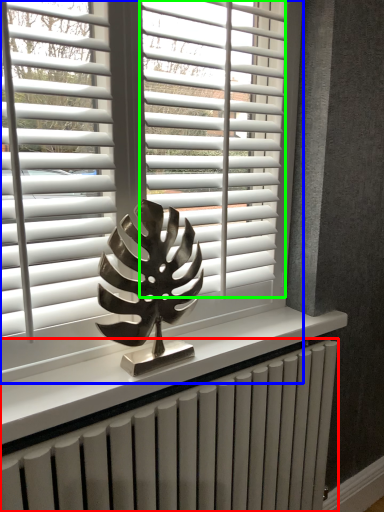
Question: Based on their relative distances, which object is nearer to radiator (highlighted by a red box)? Choose from window blind (highlighted by a blue box) and blind (highlighted by a green box).

Choices:
 (A) window blind
 (B) blind

Answer: (A)